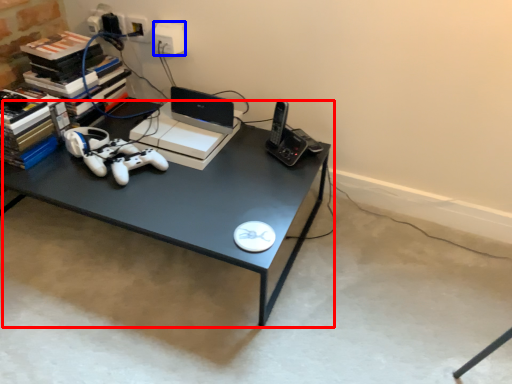
Question: Which object appears farthest to the camera in this image, desk (highlighted by a red box) or electric outlet (highlighted by a blue box)?

Choices:
 (A) desk
 (B) electric outlet

Answer: (B)